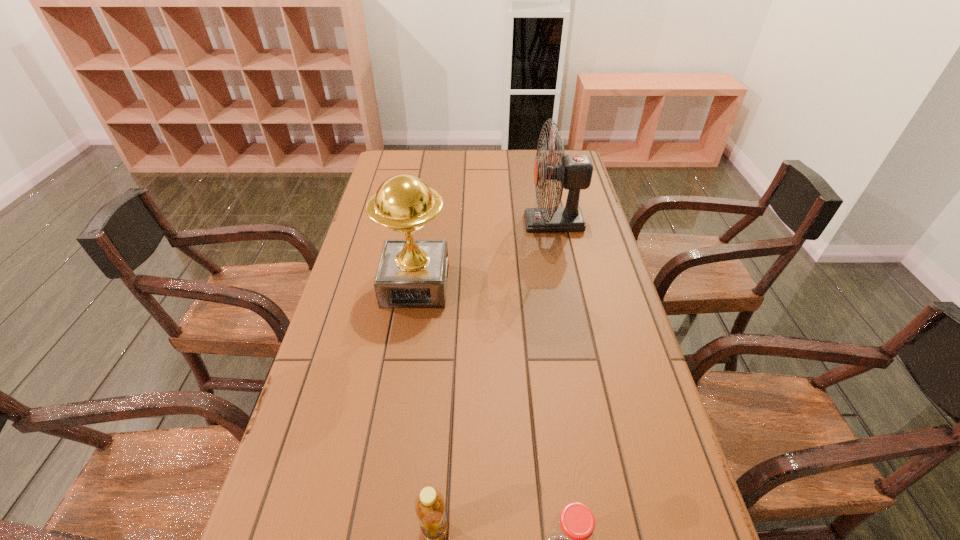
Identify the location of free space at the right edge. (626, 510).

Where is `free region at the far left corner of the desktop`? free region at the far left corner of the desktop is located at coordinates (382, 167).

Locate an element on the screen. vacant region between the farthest object and the award is located at coordinates (485, 254).

Find the location of `free space between the fan and the second farthest object`. free space between the fan and the second farthest object is located at coordinates (485, 254).

You are a GUI agent. You are given a task and a screenshot of the screen. Output one action in this format:
    pyautogui.click(x=<x>, y=<y>)
    Task: Click on the object that is the closest to the right bottle
    
    Given the screenshot: What is the action you would take?
    pyautogui.click(x=429, y=505)

Locate an element on the screen. The width and height of the screenshot is (960, 540). object that is the third nearest to the left bottle is located at coordinates (574, 173).

Where is `blank space that satisfies the following two spatial constraints: 1. on the front-facing side of the fan; 2. on the front-facing side of the award`? blank space that satisfies the following two spatial constraints: 1. on the front-facing side of the fan; 2. on the front-facing side of the award is located at coordinates (566, 285).